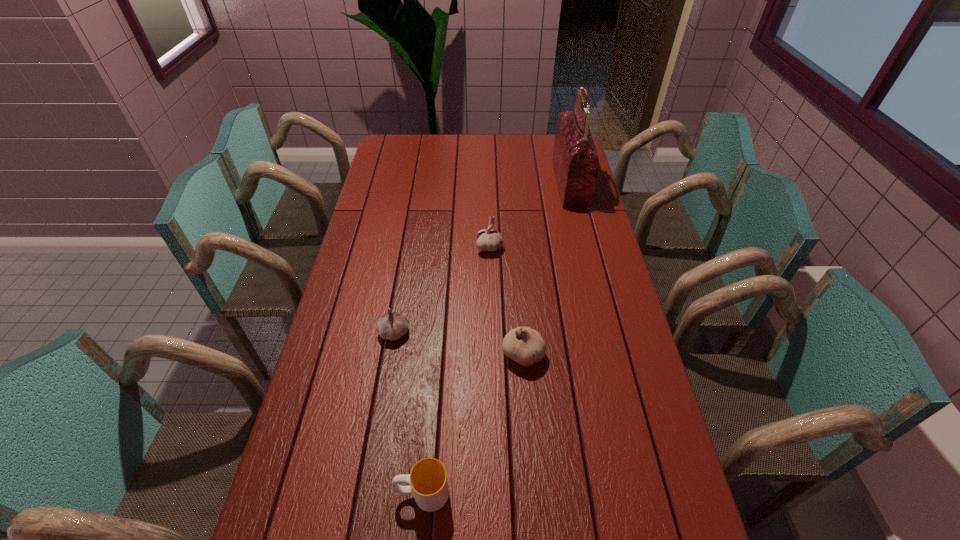
You are a GUI agent. You are given a task and a screenshot of the screen. Output one action in this format:
    pyautogui.click(x=<x>, y=<y>)
    Task: Click on the free space located on the back of the leftmost garlic
    Image resolution: width=960 pixels, height=540 pixels.
    Given the screenshot: What is the action you would take?
    pyautogui.click(x=404, y=273)

Find the location of a particular element. This screenshot has height=540, width=960. vacant area situated with the handle on the side of the second object from left to right is located at coordinates (369, 493).

At what (x,y) coordinates should I click in order to perform the action: click on free spot located 0.250m with the handle on the side of the second object from left to right. Please return your answer as a coordinate pair (x, y). Looking at the image, I should click on (281, 493).

At what (x,y) coordinates should I click in order to perform the action: click on vacant space situated with the handle on the side of the second object from left to right. Please return your answer as a coordinate pair (x, y). This screenshot has width=960, height=540. Looking at the image, I should click on (300, 493).

Identify the location of object present at the far edge. The image size is (960, 540). [576, 164].

Find the location of `object present at the left edge`. object present at the left edge is located at coordinates (392, 326).

The height and width of the screenshot is (540, 960). Identify the location of object positioned at the right edge. (576, 164).

Where is `object positioned at the far right corner`? The image size is (960, 540). object positioned at the far right corner is located at coordinates (576, 164).

Find the location of a particular element. The image size is (960, 540). vacant area at the far edge is located at coordinates 528,150.

In the image, there is a desktop. At what (x,y) coordinates should I click in order to perform the action: click on vacant space at the left edge. Please return your answer as a coordinate pair (x, y). Image resolution: width=960 pixels, height=540 pixels. Looking at the image, I should click on (406, 167).